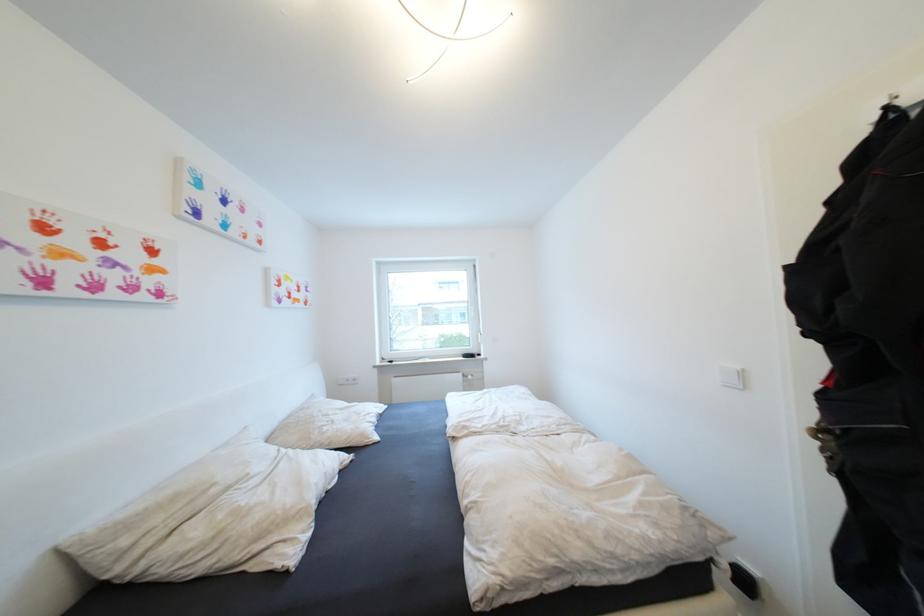
The height and width of the screenshot is (616, 924). Find the location of `white electrical outlet`. white electrical outlet is located at coordinates (346, 375).